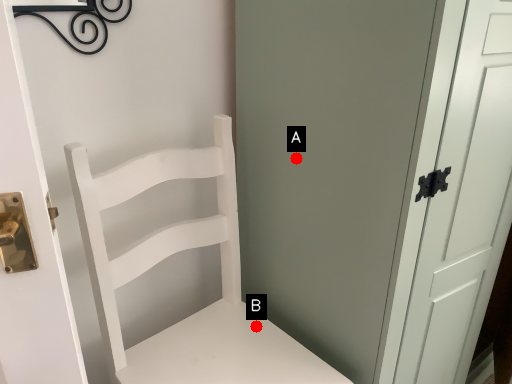
Question: Two points are circled on the image, labeled by A and B beside each circle. Which point is farther to the camera?

Choices:
 (A) A is further
 (B) B is further

Answer: (B)